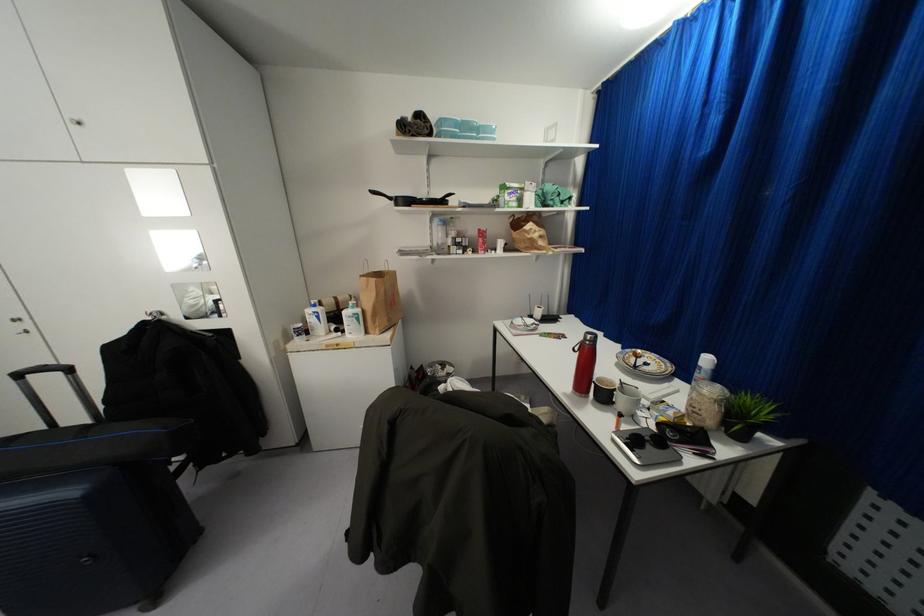
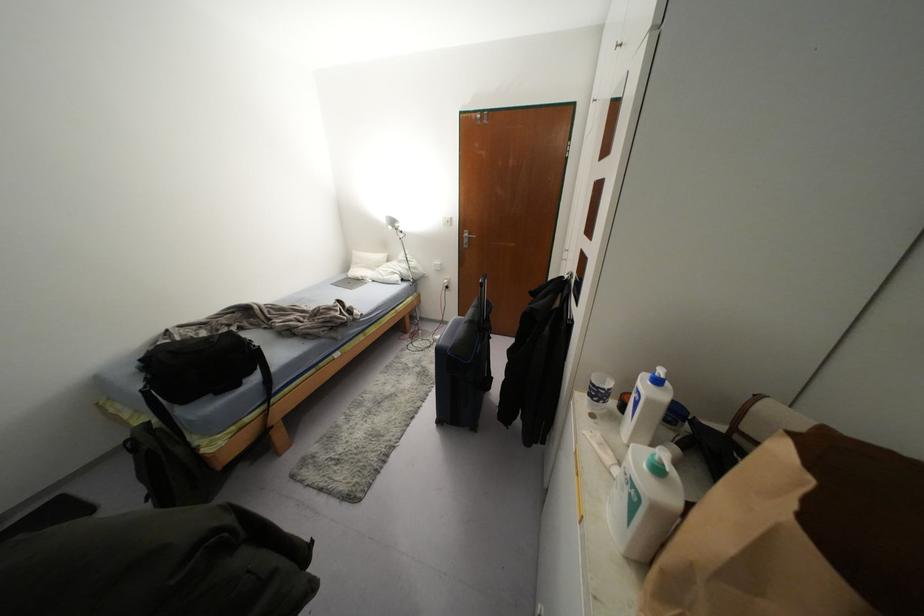
Find the pixel in the second image that matches point (313, 305) in the first image.

(658, 381)